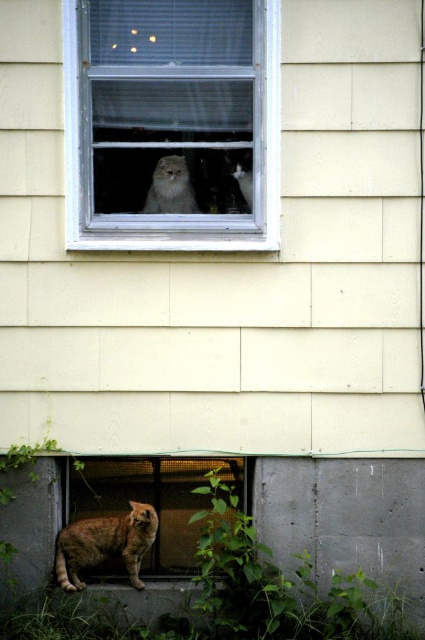
Is point (274, 77) positioned in front of point (102, 556)?

Yes, it is in front of point (102, 556).

Who is positioned more to the left, white plastic window at upper center or tabby fur cat at lower left?

From the viewer's perspective, tabby fur cat at lower left appears more on the left side.

Image resolution: width=425 pixels, height=640 pixels. In order to click on white plastic window at upper center in this screenshot , I will do `click(170, 225)`.

This screenshot has height=640, width=425. Describe the element at coordinates (104, 544) in the screenshot. I see `tabby fur cat at lower left` at that location.

I want to click on tabby fur cat at lower left, so click(104, 544).

Who is positioned more to the left, translucent mesh door at lower center or tabby fur cat at lower left?

tabby fur cat at lower left is more to the left.

Describe the element at coordinates (141, 524) in the screenshot. The image size is (425, 640). I see `translucent mesh door at lower center` at that location.

Where is `translucent mesh door at lower center`? translucent mesh door at lower center is located at coordinates (141, 524).

Where is `translucent mesh door at lower center`? The image size is (425, 640). translucent mesh door at lower center is located at coordinates (141, 524).